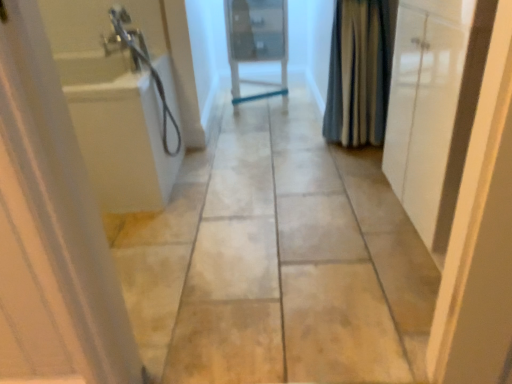
Question: From a real-world perspective, is white glossy cabinet at right, marked as the second door in a front-to-back arrangement, positioned over beige tile floor at center based on gravity?

Choices:
 (A) no
 (B) yes

Answer: (B)

Question: Can you confirm if white glossy cabinet at right, marked as the second door in a front-to-back arrangement, is wider than beige tile floor at center?

Choices:
 (A) yes
 (B) no

Answer: (B)

Question: Considering the relative positions of white glossy cabinet at right, arranged as the second door when viewed from the back, and beige tile floor at center in the image provided, is white glossy cabinet at right, arranged as the second door when viewed from the back, to the left of beige tile floor at center from the viewer's perspective?

Choices:
 (A) yes
 (B) no

Answer: (B)

Question: Could beige tile floor at center be considered to be inside white glossy cabinet at right, which is the 3th door from left to right?

Choices:
 (A) no
 (B) yes

Answer: (A)

Question: From the image's perspective, is white glossy cabinet at right, which is the 3th door from left to right, on top of beige tile floor at center?

Choices:
 (A) yes
 (B) no

Answer: (A)

Question: Can you confirm if white glossy cabinet at right, arranged as the second door when viewed from the back, is shorter than beige tile floor at center?

Choices:
 (A) yes
 (B) no

Answer: (B)

Question: Does white glossy door at left, marked as the 3th door in a back-to-front arrangement, have a larger size compared to white glossy cabinet at right, marked as the second door in a front-to-back arrangement?

Choices:
 (A) no
 (B) yes

Answer: (A)

Question: Does white glossy door at left, marked as the 3th door in a back-to-front arrangement, have a greater width compared to white glossy cabinet at right, marked as the second door in a front-to-back arrangement?

Choices:
 (A) yes
 (B) no

Answer: (B)

Question: Does white glossy door at left, marked as the 3th door in a back-to-front arrangement, appear on the left side of white glossy cabinet at right, arranged as the second door when viewed from the back?

Choices:
 (A) no
 (B) yes

Answer: (B)

Question: Is white glossy door at left, marked as the 3th door in a back-to-front arrangement, to the right of white glossy cabinet at right, arranged as the second door when viewed from the back, from the viewer's perspective?

Choices:
 (A) yes
 (B) no

Answer: (B)

Question: Can you confirm if white glossy door at left, marked as the 3th door in a back-to-front arrangement, is smaller than white glossy cabinet at right, arranged as the second door when viewed from the back?

Choices:
 (A) yes
 (B) no

Answer: (A)

Question: Is white glossy door at left, which is counted as the first door, starting from the front, not within white glossy cabinet at right, marked as the second door in a front-to-back arrangement?

Choices:
 (A) yes
 (B) no

Answer: (A)

Question: Is white glossy door at left, which ranks as the 3th door in right-to-left order, wider than white glossy door at center, the second door from the left?

Choices:
 (A) no
 (B) yes

Answer: (A)